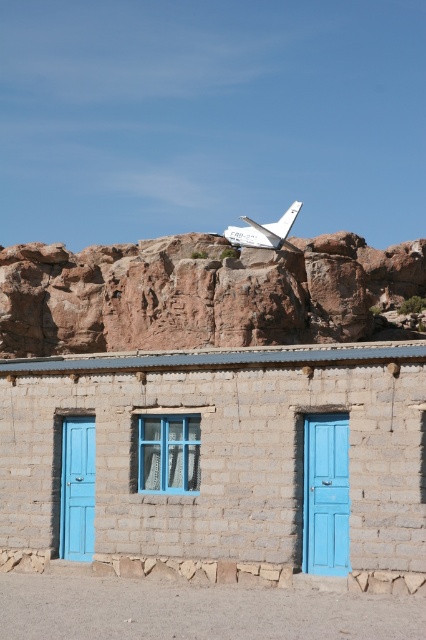
You are standing in front of the rustic stone building and want to take a photo of both the brown stone cliff at upper center and the brown rocky cliff at upper center. Which direction should you turn to ensure both are in the frame?

To capture both the brown stone cliff at upper center and the brown rocky cliff at upper center in your photo, you should position yourself so that the brown stone cliff at upper center is to the right of the brown rocky cliff at upper center, as it is located to the right of it.

You are standing at the point marked by coordinates point (325, 493). Looking towards the building with the blue doors and window, which object are you directly facing?

You are directly facing the blue matte door at center, as the coordinates point (325, 493) corresponds to that object.